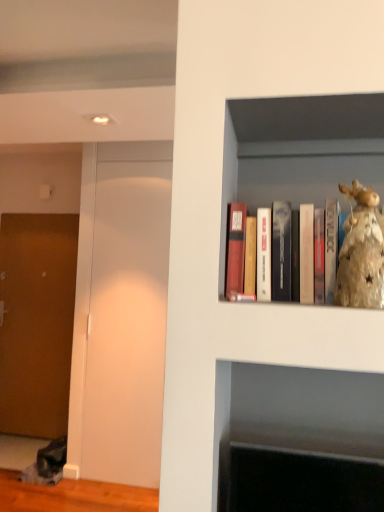
At what (x,y) coordinates should I click in order to perform the action: click on vacant space in front of transparent glass door at left. Please return your answer as a coordinate pair (x, y). Looking at the image, I should click on (111, 497).